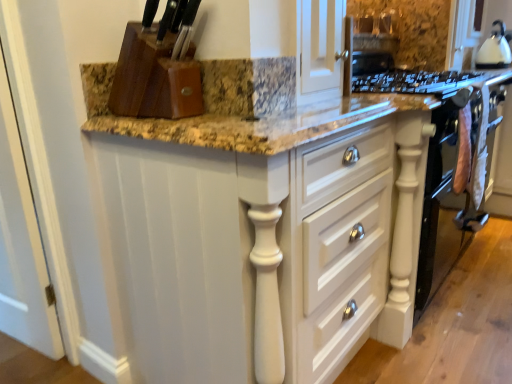
Question: Is white glossy kettle at upper right positioned before white painted wood cabinet at center?

Choices:
 (A) no
 (B) yes

Answer: (A)

Question: Can we say white glossy kettle at upper right lies outside white painted wood cabinet at center?

Choices:
 (A) no
 (B) yes

Answer: (B)

Question: Does white glossy kettle at upper right have a lesser height compared to white painted wood cabinet at center?

Choices:
 (A) yes
 (B) no

Answer: (A)

Question: Is white glossy kettle at upper right behind white painted wood cabinet at center?

Choices:
 (A) yes
 (B) no

Answer: (A)

Question: From the image's perspective, is white glossy kettle at upper right located above white painted wood cabinet at center?

Choices:
 (A) yes
 (B) no

Answer: (A)

Question: Considering the relative sizes of white glossy kettle at upper right and white painted wood cabinet at center in the image provided, is white glossy kettle at upper right wider than white painted wood cabinet at center?

Choices:
 (A) yes
 (B) no

Answer: (B)

Question: From the image's perspective, is white painted wood cabinet at center below white glossy kettle at upper right?

Choices:
 (A) yes
 (B) no

Answer: (A)

Question: Can white glossy kettle at upper right be found inside white painted wood cabinet at center?

Choices:
 (A) yes
 (B) no

Answer: (B)

Question: Is white painted wood cabinet at center turned away from white glossy kettle at upper right?

Choices:
 (A) yes
 (B) no

Answer: (B)

Question: Is white painted wood cabinet at center thinner than white glossy kettle at upper right?

Choices:
 (A) yes
 (B) no

Answer: (B)

Question: From a real-world perspective, is white painted wood cabinet at center positioned under white glossy kettle at upper right based on gravity?

Choices:
 (A) yes
 (B) no

Answer: (A)

Question: Is white painted wood cabinet at center outside of white glossy kettle at upper right?

Choices:
 (A) yes
 (B) no

Answer: (A)

Question: From a real-world perspective, is white glossy kettle at upper right above or below white painted wood cabinet at center?

Choices:
 (A) above
 (B) below

Answer: (A)